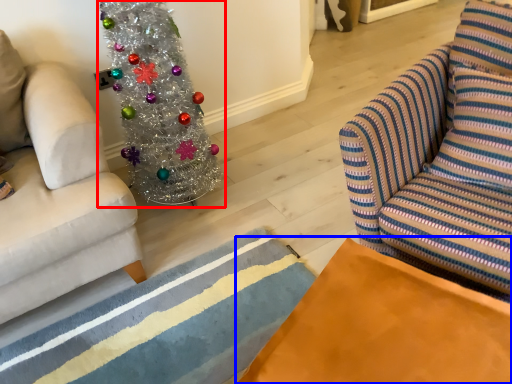
Question: Which point is further to the camera, christmas tree (highlighted by a red box) or table (highlighted by a blue box)?

Choices:
 (A) christmas tree
 (B) table

Answer: (A)